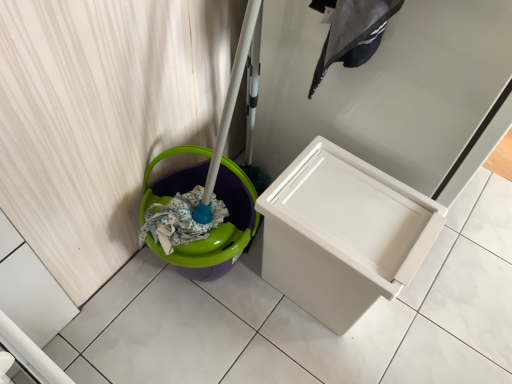
The height and width of the screenshot is (384, 512). What are the coordinates of `free space in front of white plastic drawer at center` in the screenshot? It's located at (372, 327).